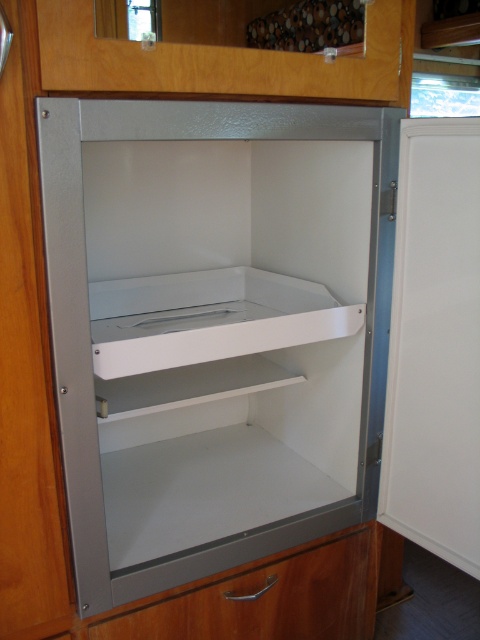
Between white matte cabinet at center and matte silver drawer at lower center, which one is positioned higher?

Positioned higher is white matte cabinet at center.

Is white matte cabinet at center wider than matte silver drawer at lower center?

Indeed, white matte cabinet at center has a greater width compared to matte silver drawer at lower center.

The width and height of the screenshot is (480, 640). I want to click on white matte cabinet at center, so click(x=215, y=328).

Find the location of a particular element. white matte cabinet at center is located at coordinates (215, 328).